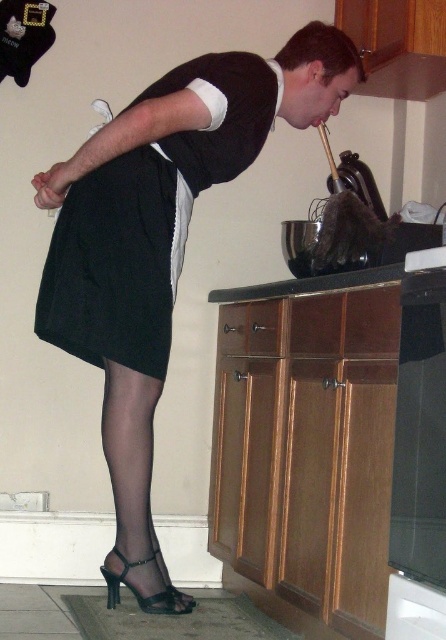
Question: Can you confirm if black fabric dress at center is positioned to the left of black sheer stocking at lower left?

Choices:
 (A) yes
 (B) no

Answer: (B)

Question: Can you confirm if black matte dress at center is smaller than black fabric dress at center?

Choices:
 (A) no
 (B) yes

Answer: (A)

Question: Which object is the farthest from the black matte dress at center?

Choices:
 (A) black sheer tights at lower left
 (B) black fabric dress at center

Answer: (A)

Question: Which object appears closest to the camera in this image?

Choices:
 (A) black matte dress at center
 (B) black sheer tights at lower left
 (C) black sheer stocking at lower left
 (D) black fabric dress at center

Answer: (A)

Question: Does black matte dress at center have a greater width compared to black sheer tights at lower left?

Choices:
 (A) yes
 (B) no

Answer: (A)

Question: Which point is farther to the camera?

Choices:
 (A) black sheer stocking at lower left
 (B) black sheer tights at lower left
 (C) black fabric dress at center

Answer: (A)